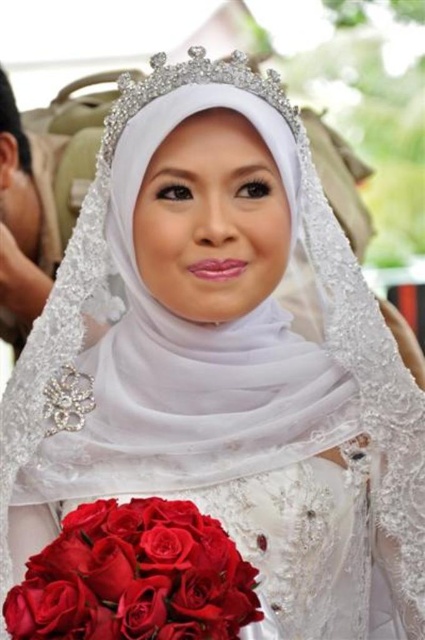
You are standing in front of the wedding scene and want to know which of the two points, point (139, 500) or point (226, 61), is nearer to you. Can you determine this?

Point (139, 500) is closer to the viewer than point (226, 61).

You are a photographer planning to capture the wedding scene. You want to ensure both the shiny silk bouquet at lower left and the clear crystal tiara at upper center are clearly visible in the photo. Given their sizes, which object should you focus on first to ensure proper framing?

The clear crystal tiara at upper center is larger than the shiny silk bouquet at lower left, so focusing on the clear crystal tiara at upper center first would help ensure proper framing for both objects.

You are a photographer at a wedding and need to decide where to focus your camera. You have to choose between the shiny silk bouquet at lower left and the clear crystal tiara at upper center. Which object should you focus on if you want to capture the larger one?

The shiny silk bouquet at lower left is larger in size than the clear crystal tiara at upper center, so you should focus on the shiny silk bouquet at lower left to capture the larger one.